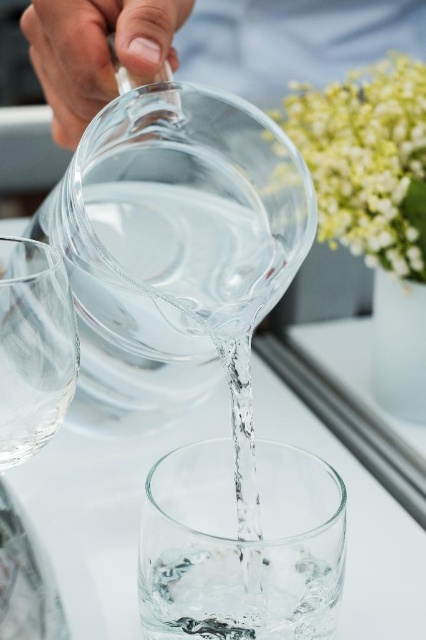
You are setting up a dining table and need to pour water from the clear glass pitcher at upper center into the transparent glass wine glass at left. Based on their positions, will the water flow naturally into the glass without needing to adjust their positions?

The clear glass pitcher at upper center is located above the transparent glass wine glass at left, so the water will flow naturally into the glass without needing to adjust their positions.

You are trying to locate the clear glass pitcher at upper center in the image. What are its coordinates?

The clear glass pitcher at upper center is located at coordinates point (207, 45).

You are trying to pour water from the clear glass pitcher at upper center into the second glass. The second glass is positioned slightly below the pitcher. How far apart are the two glasses?

The clear glass pitcher at upper center and the second glass are 27.90 centimeters apart.